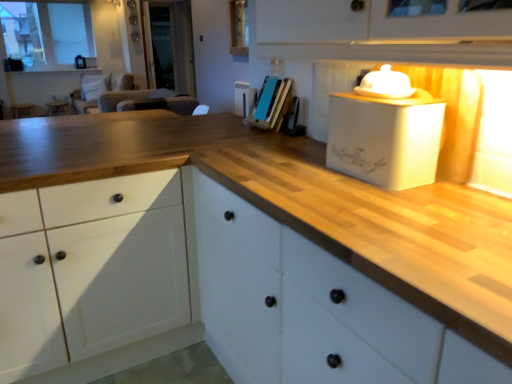
Question: Considering the positions of white glass window at upper left and blue matte book at center in the image, is white glass window at upper left taller or shorter than blue matte book at center?

Choices:
 (A) tall
 (B) short

Answer: (A)

Question: Which is correct: white glass window at upper left is inside blue matte book at center, or outside of it?

Choices:
 (A) outside
 (B) inside

Answer: (A)

Question: Estimate the real-world distances between objects in this image. Which object is farther from the white wood cabinet at center?

Choices:
 (A) white ceramic lid at upper right, the 1th appliance when ordered from top to bottom
 (B) white glass window at upper left
 (C) white matte box at upper right, which ranks as the second appliance in top-to-bottom order
 (D) transparent glass door at center
 (E) blue matte book at center

Answer: (B)

Question: Estimate the real-world distances between objects in this image. Which object is closer to the white matte box at upper right, which appears as the 1th appliance when ordered from the bottom?

Choices:
 (A) white wood cabinet at center
 (B) white glass window at upper left
 (C) blue matte book at center
 (D) white ceramic lid at upper right, the 2th appliance ordered from the bottom
 (E) transparent glass door at center

Answer: (D)